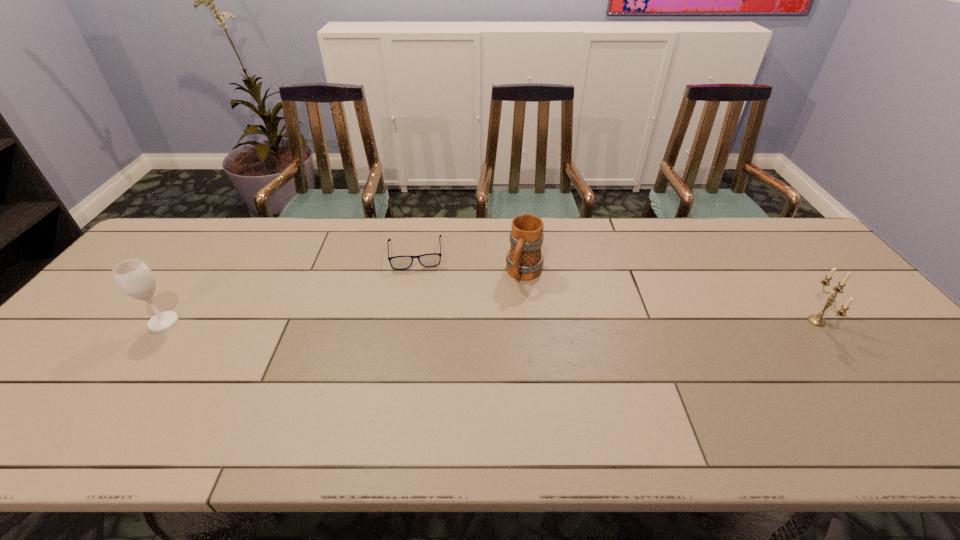
Find the location of `vacant space at the far right corner`. vacant space at the far right corner is located at coordinates (755, 222).

At what (x,y) coordinates should I click in order to perform the action: click on vacant area at the near right corner. Please return your answer as a coordinate pair (x, y). Looking at the image, I should click on [916, 396].

Where is `vacant area that lies between the candle and the wineglass`? vacant area that lies between the candle and the wineglass is located at coordinates (491, 322).

I want to click on free space that is in between the wineglass and the third object from left to right, so click(x=345, y=298).

Locate an element on the screen. The image size is (960, 540). blank region between the wineglass and the second object from left to right is located at coordinates (290, 288).

Image resolution: width=960 pixels, height=540 pixels. Identify the location of vacant space that is in between the rightmost object and the second object from right to left. click(670, 297).

At what (x,y) coordinates should I click in order to perform the action: click on free space between the second object from left to right and the leftmost object. Please return your answer as a coordinate pair (x, y). This screenshot has width=960, height=540. Looking at the image, I should click on pyautogui.click(x=290, y=288).

I want to click on free space between the mug and the spectacles, so click(470, 264).

Locate an element on the screen. This screenshot has height=540, width=960. vacant space in between the third object from left to right and the spectacles is located at coordinates (470, 264).

Identify the location of empty space that is in between the wineglass and the candle. (491, 322).